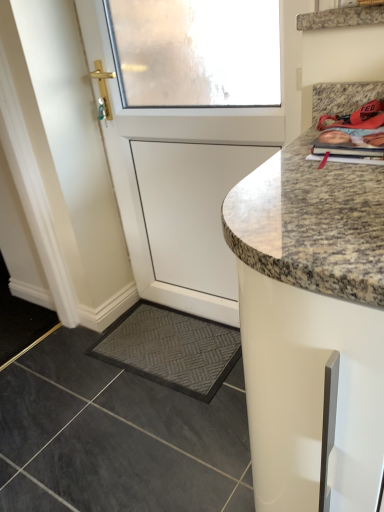
Where is `free spot above matte orange magazine at upper right (from a real-world perspective)`? free spot above matte orange magazine at upper right (from a real-world perspective) is located at coordinates (358, 126).